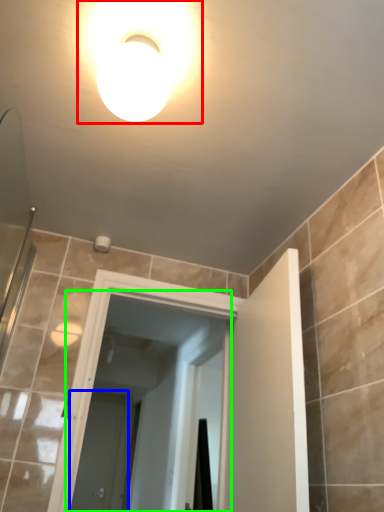
Question: Considering the real-world distances, which object is closest to light fixture (highlighted by a red box)? screen door (highlighted by a blue box) or screen door (highlighted by a green box).

Choices:
 (A) screen door
 (B) screen door

Answer: (B)